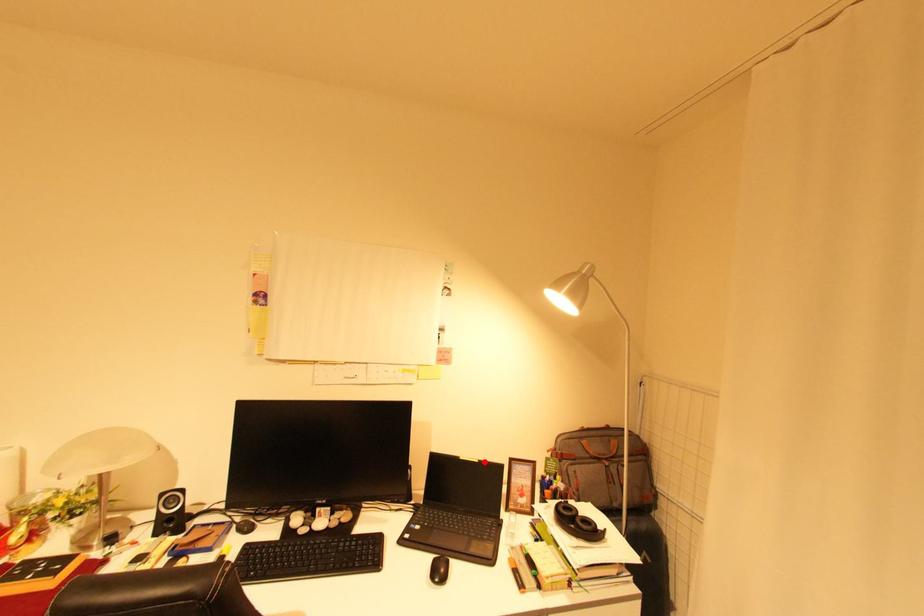
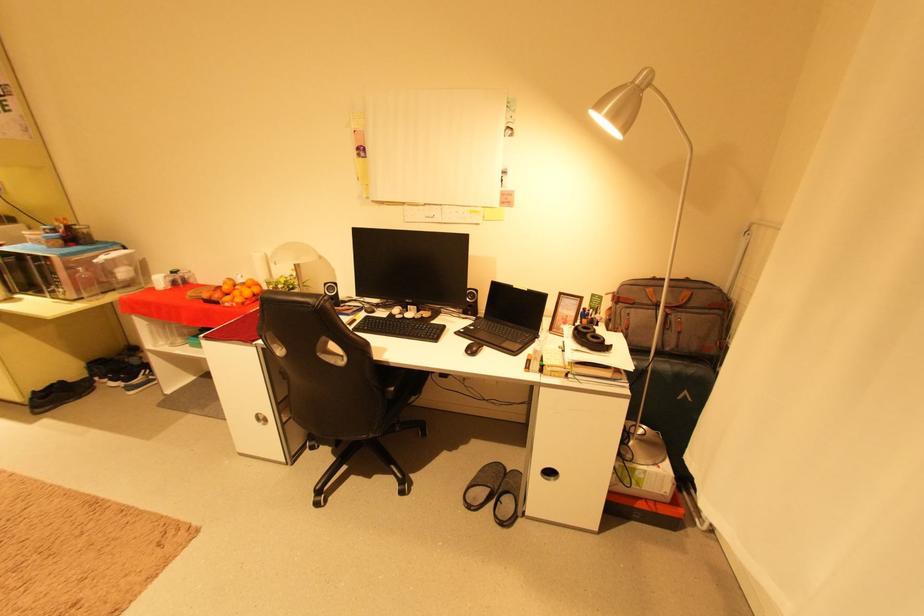
The point at the highlighted location is marked in the first image. Where is the corresponding point in the second image?

(533, 291)